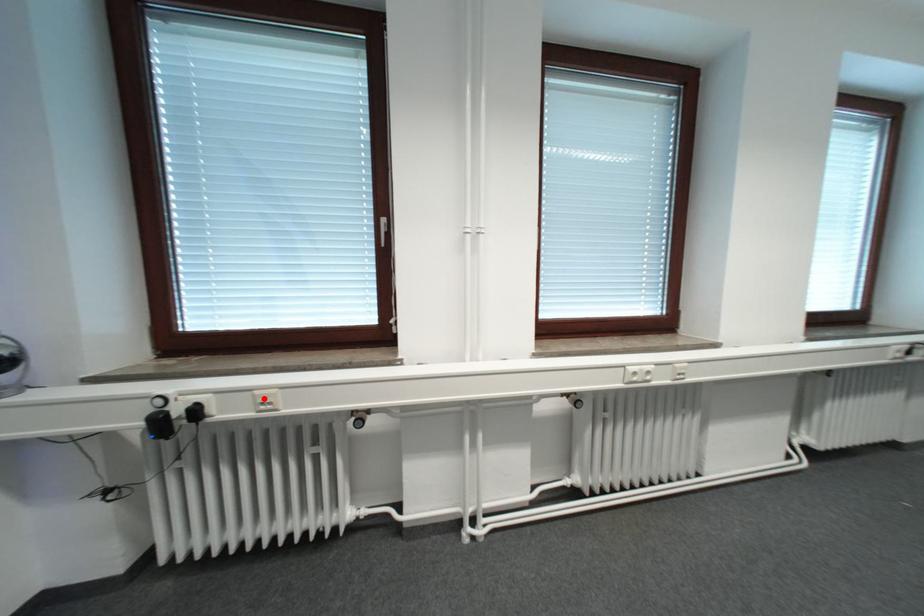
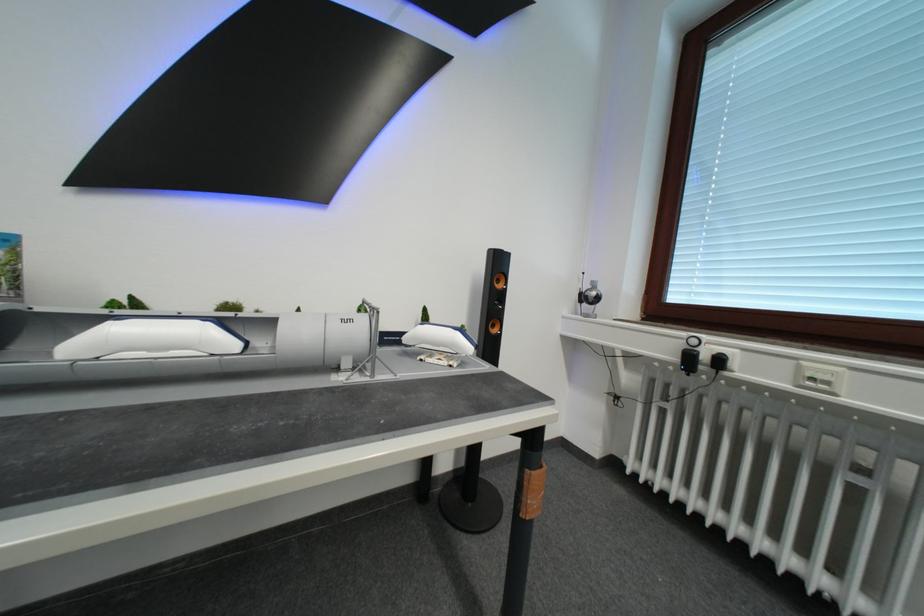
In the second image, find the point that corresponds to the highlighted location in the first image.

(809, 369)